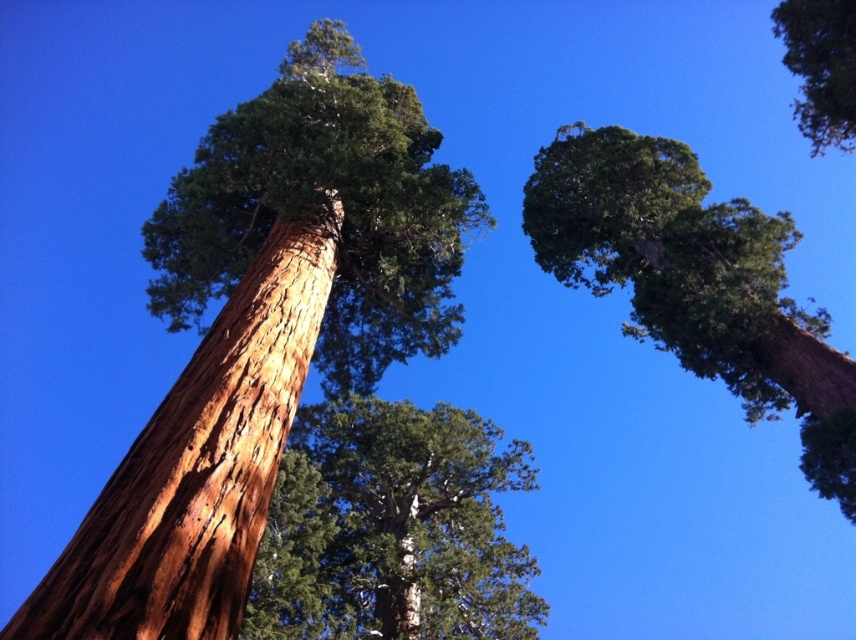
Is rough bark tree at center to the left of green rough bark tree at upper right from the viewer's perspective?

Indeed, rough bark tree at center is positioned on the left side of green rough bark tree at upper right.

Where is `rough bark tree at center`? This screenshot has height=640, width=856. rough bark tree at center is located at coordinates (263, 333).

Is point (333, 42) less distant than point (250, 480)?

No, it is not.

Can you confirm if rough bark tree at center is shorter than rough brown bark at center?

No.

Where is `rough bark tree at center`? This screenshot has height=640, width=856. rough bark tree at center is located at coordinates (263, 333).

Who is shorter, rough brown bark at center or green rough bark tree at center?

rough brown bark at center is shorter.

You are a GUI agent. You are given a task and a screenshot of the screen. Output one action in this format:
    pyautogui.click(x=<x>, y=<y>)
    Task: Click on the rough brown bark at center
    Image resolution: width=856 pixels, height=640 pixels.
    Given the screenshot: What is the action you would take?
    pyautogui.click(x=195, y=468)

Does point (141, 488) come farther from viewer compared to point (381, 605)?

That is False.

Find the location of a particular element. rough brown bark at center is located at coordinates (195, 468).